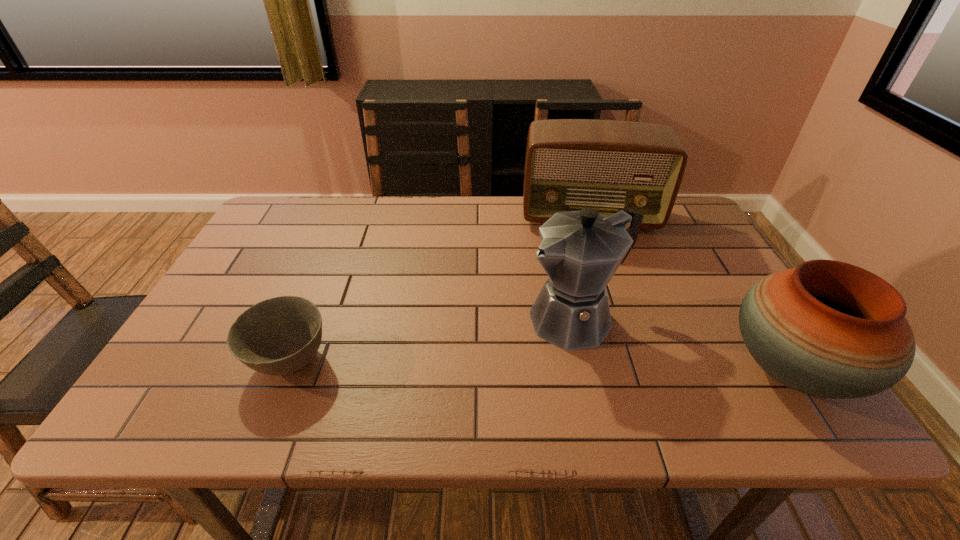
I want to click on vacant space that is in between the third tallest object and the bowl, so click(x=540, y=364).

Identify the location of vacant space that is in between the radio receiver and the shortest object. The height and width of the screenshot is (540, 960). (440, 289).

Locate an element on the screen. This screenshot has width=960, height=540. vacant space that's between the pottery and the coffeepot is located at coordinates (684, 345).

Find the location of a particular element. The width and height of the screenshot is (960, 540). free space between the shortest object and the second shortest object is located at coordinates (540, 364).

Find the location of a particular element. Image resolution: width=960 pixels, height=540 pixels. unoccupied position between the coffeepot and the second shortest object is located at coordinates (684, 345).

The width and height of the screenshot is (960, 540). Find the location of `free space between the bowl and the coffeepot`. free space between the bowl and the coffeepot is located at coordinates (433, 340).

This screenshot has width=960, height=540. I want to click on blank region between the shortest object and the farthest object, so click(x=440, y=289).

Where is `free space between the leftmost object and the pottery`? The height and width of the screenshot is (540, 960). free space between the leftmost object and the pottery is located at coordinates (540, 364).

Image resolution: width=960 pixels, height=540 pixels. In order to click on object that is the closest to the shortest object in this screenshot , I will do `click(580, 251)`.

Where is `object that is the third nearest to the shortest object`? This screenshot has width=960, height=540. object that is the third nearest to the shortest object is located at coordinates (826, 328).